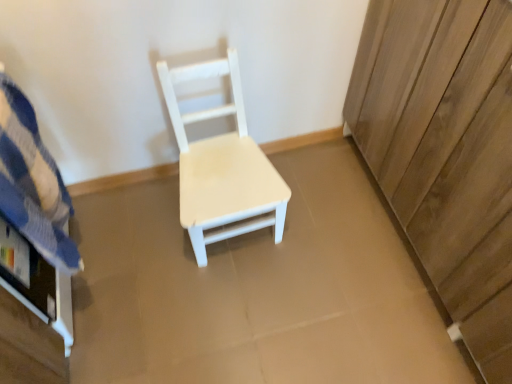
Question: From a real-world perspective, is white matte wood chair at center on blue striped fabric at left?

Choices:
 (A) yes
 (B) no

Answer: (B)

Question: Would you say white matte wood chair at center contains blue striped fabric at left?

Choices:
 (A) yes
 (B) no

Answer: (B)

Question: Would you say white matte wood chair at center is outside blue striped fabric at left?

Choices:
 (A) yes
 (B) no

Answer: (A)

Question: Is white matte wood chair at center taller than blue striped fabric at left?

Choices:
 (A) no
 (B) yes

Answer: (B)

Question: Are white matte wood chair at center and blue striped fabric at left located far from each other?

Choices:
 (A) no
 (B) yes

Answer: (A)

Question: From a real-world perspective, is white matte wood chair at center below blue striped fabric at left?

Choices:
 (A) yes
 (B) no

Answer: (A)

Question: Is white matte wood chair at center located outside wooden dresser at right?

Choices:
 (A) no
 (B) yes

Answer: (B)

Question: Can you confirm if white matte wood chair at center is smaller than wooden dresser at right?

Choices:
 (A) yes
 (B) no

Answer: (A)

Question: Does white matte wood chair at center lie in front of wooden dresser at right?

Choices:
 (A) yes
 (B) no

Answer: (B)

Question: From a real-world perspective, is white matte wood chair at center beneath wooden dresser at right?

Choices:
 (A) no
 (B) yes

Answer: (B)

Question: Does white matte wood chair at center appear on the right side of wooden dresser at right?

Choices:
 (A) yes
 (B) no

Answer: (B)

Question: Is white matte wood chair at center oriented away from wooden dresser at right?

Choices:
 (A) no
 (B) yes

Answer: (A)

Question: Does wooden dresser at right have a lesser height compared to blue striped fabric at left?

Choices:
 (A) yes
 (B) no

Answer: (B)